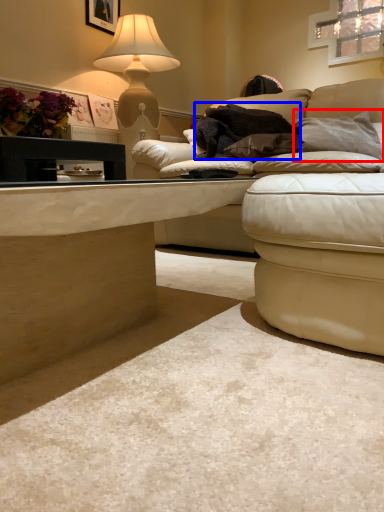
Question: Which point is further to the camera, pillow (highlighted by a red box) or blanket (highlighted by a blue box)?

Choices:
 (A) pillow
 (B) blanket

Answer: (B)